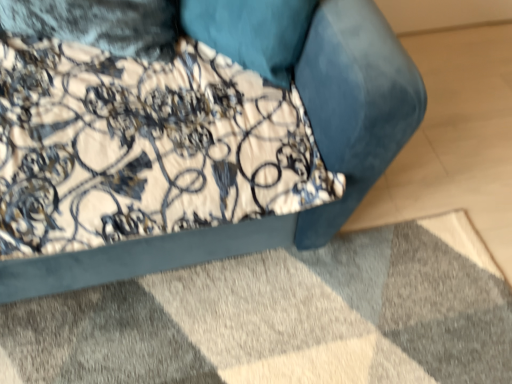
Describe the element at coordinates (283, 317) in the screenshot. I see `velvet blue mat at lower center` at that location.

In order to click on velvet blue mat at lower center in this screenshot , I will do `click(283, 317)`.

What do you see at coordinates (319, 148) in the screenshot?
I see `velvet blue sofa at upper center` at bounding box center [319, 148].

Where is `velvet blue sofa at upper center`? velvet blue sofa at upper center is located at coordinates (319, 148).

Looking at this image, measure the distance between point [111,249] and camera.

They are 92.70 centimeters apart.

Image resolution: width=512 pixels, height=384 pixels. I want to click on velvet blue mat at lower center, so click(283, 317).

In the image, is velvet blue mat at lower center on the left side or the right side of velvet blue sofa at upper center?

velvet blue mat at lower center is positioned on velvet blue sofa at upper center's right side.

Who is more distant, velvet blue mat at lower center or velvet blue sofa at upper center?

Positioned behind is velvet blue mat at lower center.

Considering the positions of point (274, 350) and point (402, 77), is point (274, 350) closer or farther from the camera than point (402, 77)?

Point (274, 350).

From the image's perspective, which is below, velvet blue mat at lower center or velvet blue sofa at upper center?

velvet blue mat at lower center.

From a real-world perspective, is velvet blue mat at lower center below velvet blue sofa at upper center?

Indeed, from a real-world perspective, velvet blue mat at lower center is positioned beneath velvet blue sofa at upper center.

Between velvet blue mat at lower center and velvet blue sofa at upper center, which one has smaller width?

velvet blue sofa at upper center is thinner.

Which of these two, velvet blue mat at lower center or velvet blue sofa at upper center, stands shorter?

With less height is velvet blue mat at lower center.

Considering the relative sizes of velvet blue mat at lower center and velvet blue sofa at upper center in the image provided, is velvet blue mat at lower center smaller than velvet blue sofa at upper center?

Yes, velvet blue mat at lower center is smaller than velvet blue sofa at upper center.

Is velvet blue mat at lower center inside or outside of velvet blue sofa at upper center?

velvet blue mat at lower center is not inside velvet blue sofa at upper center, it's outside.

Is velvet blue mat at lower center not near velvet blue sofa at upper center?

No, velvet blue mat at lower center is not far away from velvet blue sofa at upper center.

Could you tell me if velvet blue mat at lower center is facing velvet blue sofa at upper center?

No.

Can you tell me how much velvet blue mat at lower center and velvet blue sofa at upper center differ in facing direction?

The angle between the facing direction of velvet blue mat at lower center and the facing direction of velvet blue sofa at upper center is 90 degrees.

You are a GUI agent. You are given a task and a screenshot of the screen. Output one action in this format:
    pyautogui.click(x=<x>, y=<y>)
    Task: Click on the mat below the velvet blue sofa at upper center (from the image's perspective)
    
    Given the screenshot: What is the action you would take?
    pyautogui.click(x=283, y=317)

Visually, is velvet blue sofa at upper center positioned to the left or to the right of velvet blue mat at lower center?

velvet blue sofa at upper center is positioned on velvet blue mat at lower center's left side.

Looking at this image, considering their positions, is velvet blue sofa at upper center located in front of or behind velvet blue mat at lower center?

velvet blue sofa at upper center is in front of velvet blue mat at lower center.

Does point (359, 148) come behind point (258, 264)?

No, (359, 148) is closer to viewer.

From the image's perspective, between velvet blue sofa at upper center and velvet blue mat at lower center, who is located below?

From the image's view, velvet blue mat at lower center is below.

From a real-world perspective, which is physically above, velvet blue sofa at upper center or velvet blue mat at lower center?

In real-world perspective, velvet blue sofa at upper center is above.

Can you confirm if velvet blue sofa at upper center is wider than velvet blue mat at lower center?

No, velvet blue sofa at upper center is not wider than velvet blue mat at lower center.

Who is shorter, velvet blue sofa at upper center or velvet blue mat at lower center?

With less height is velvet blue mat at lower center.

Between velvet blue sofa at upper center and velvet blue mat at lower center, which one has smaller size?

velvet blue mat at lower center is smaller.

Consider the image. Is velvet blue sofa at upper center outside of velvet blue mat at lower center?

Absolutely, velvet blue sofa at upper center is external to velvet blue mat at lower center.

Is velvet blue sofa at upper center directly adjacent to velvet blue mat at lower center?

velvet blue sofa at upper center and velvet blue mat at lower center are not in contact.

Is velvet blue sofa at upper center facing towards velvet blue mat at lower center?

Yes, velvet blue sofa at upper center is oriented towards velvet blue mat at lower center.

In the image, there is a velvet blue sofa at upper center. Find the location of `mat below it (from a real-world perspective)`. mat below it (from a real-world perspective) is located at coordinates (283, 317).

Find the location of a particular element. The width and height of the screenshot is (512, 384). furniture in front of the velvet blue mat at lower center is located at coordinates (319, 148).

You are a GUI agent. You are given a task and a screenshot of the screen. Output one action in this format:
    pyautogui.click(x=<x>, y=<y>)
    Task: Click on the mat that appears below the velvet blue sofa at upper center (from a real-world perspective)
    This screenshot has height=384, width=512.
    Given the screenshot: What is the action you would take?
    pyautogui.click(x=283, y=317)